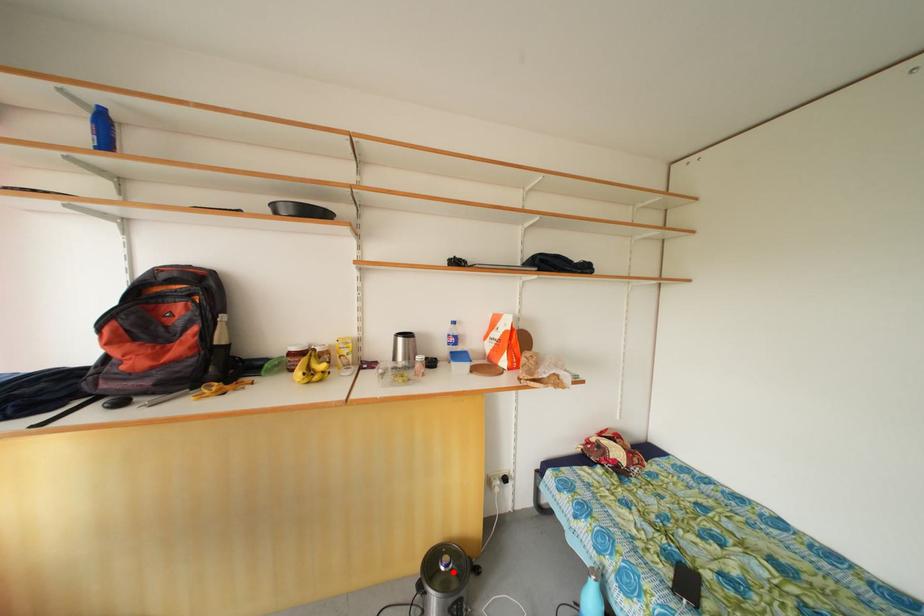
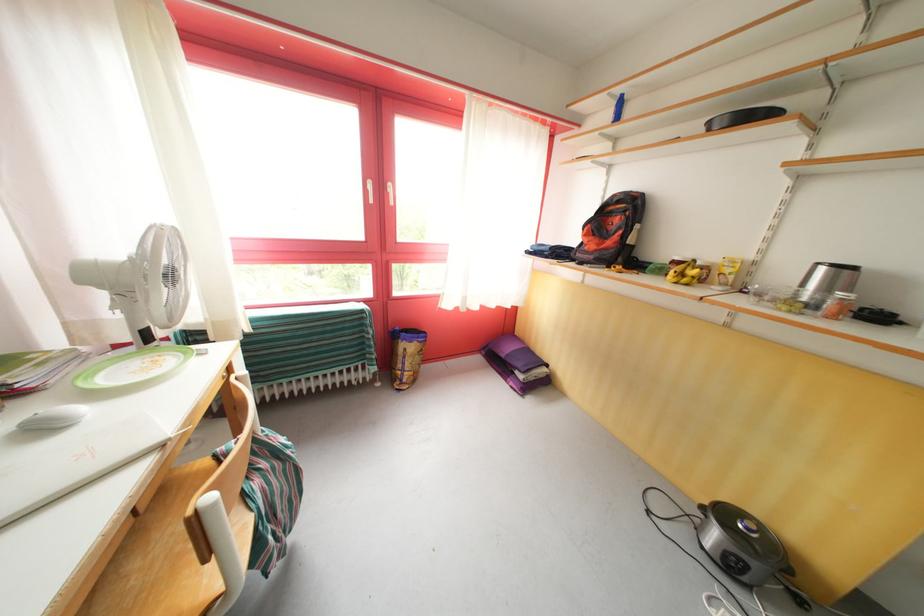
In the second image, find the point that corresponds to the highlighted location in the first image.

(755, 535)